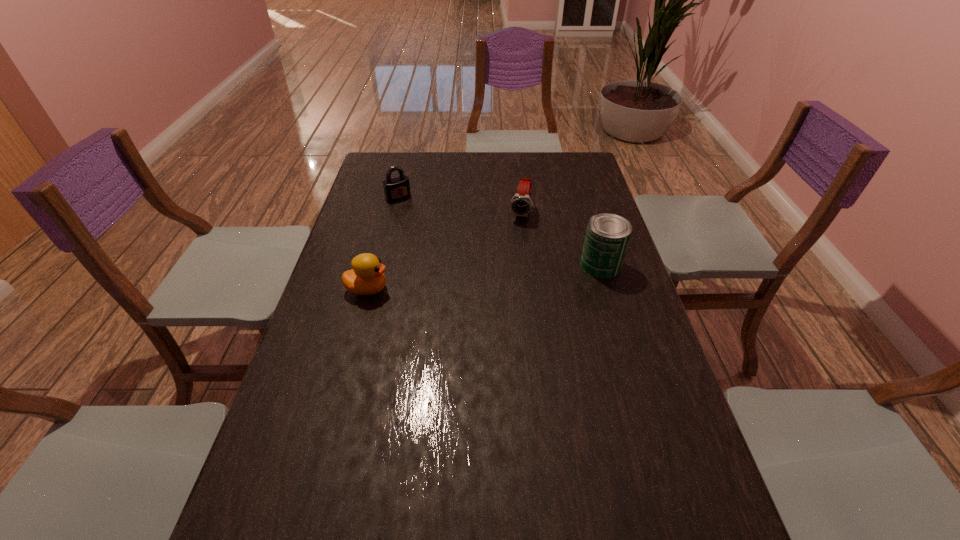
Where is `free spot located on the front of the farthest object near the keyhole`? free spot located on the front of the farthest object near the keyhole is located at coordinates pos(432,239).

Find the location of a particular element. vacant position located 0.380m on the face of the watch is located at coordinates (494, 302).

I want to click on vacant space located on the face of the watch, so tap(505, 270).

At what (x,y) coordinates should I click in order to perform the action: click on free space located 0.310m on the face of the watch. Please return your answer as a coordinate pair (x, y). This screenshot has height=540, width=960. Looking at the image, I should click on (500, 286).

What are the coordinates of `duckling that is positioned at the left edge` in the screenshot? It's located at (366, 278).

Image resolution: width=960 pixels, height=540 pixels. I want to click on padlock located at the left edge, so click(397, 188).

The height and width of the screenshot is (540, 960). Identify the location of object situated at the right edge. (607, 236).

Locate an element on the screen. This screenshot has width=960, height=540. free space at the far edge of the desktop is located at coordinates (505, 168).

In the image, there is a desktop. At what (x,y) coordinates should I click in order to perform the action: click on vacant region at the near edge. Please return your answer as a coordinate pair (x, y). Looking at the image, I should click on (418, 501).

At what (x,y) coordinates should I click in order to perform the action: click on vacant space at the left edge of the desktop. Please return your answer as a coordinate pair (x, y). The image size is (960, 540). Looking at the image, I should click on (311, 357).